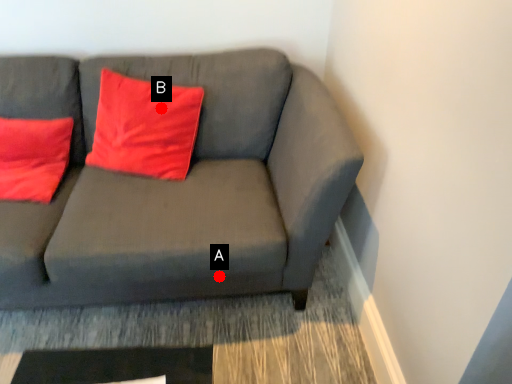
Question: Two points are circled on the image, labeled by A and B beside each circle. Among these points, which one is nearest to the camera?

Choices:
 (A) A is closer
 (B) B is closer

Answer: (A)